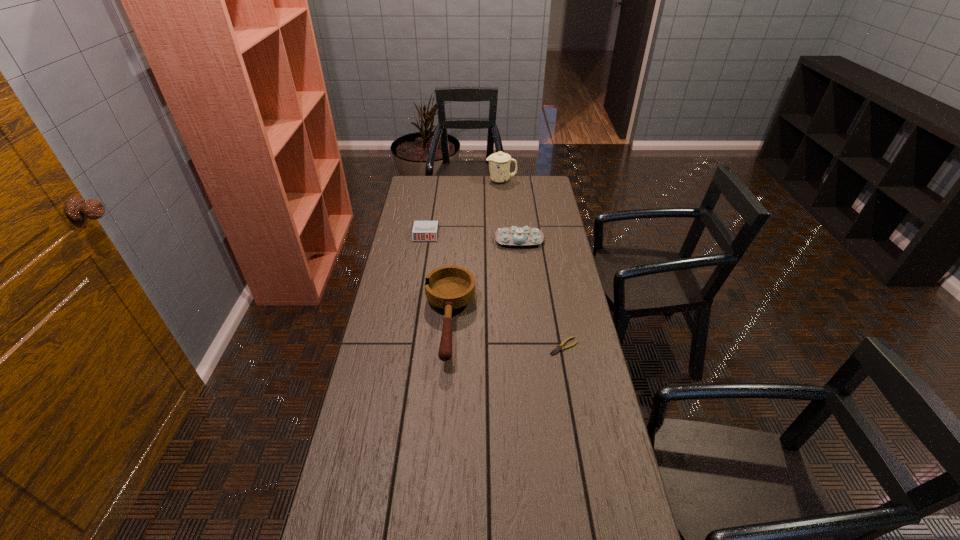
Locate an element on the screen. This screenshot has height=540, width=960. vacant space located 0.310m on the front of the shorter chinaware is located at coordinates (525, 298).

At what (x,y) coordinates should I click in order to perform the action: click on free space located 0.380m on the back of the alarm clock. Please return your answer as a coordinate pair (x, y). Image resolution: width=960 pixels, height=540 pixels. Looking at the image, I should click on 433,187.

Where is `blank space located 0.100m on the back of the shortest object`? blank space located 0.100m on the back of the shortest object is located at coordinates (559, 317).

You are a GUI agent. You are given a task and a screenshot of the screen. Output one action in this format:
    pyautogui.click(x=<x>, y=<y>)
    Task: Click on the object situated at the far edge
    The width and height of the screenshot is (960, 540).
    Given the screenshot: What is the action you would take?
    pyautogui.click(x=499, y=163)

Identify the location of object that is positioned at the left edge. (422, 230).

This screenshot has height=540, width=960. Find the location of `chinaware at the right edge`. chinaware at the right edge is located at coordinates (516, 236).

This screenshot has height=540, width=960. I want to click on pliers positioned at the right edge, so click(559, 347).

In the image, there is a desktop. Identify the location of blank space at the left edge. (398, 323).

Locate an element on the screen. The height and width of the screenshot is (540, 960). free space at the right edge is located at coordinates (564, 359).

The width and height of the screenshot is (960, 540). I want to click on free region at the far left corner of the desktop, so click(x=425, y=186).